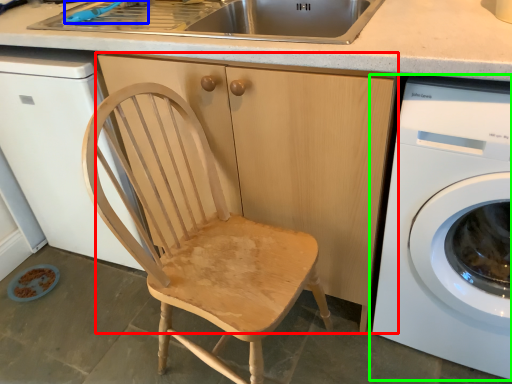
Question: Which object is the closest to the cabinetry (highlighted by a red box)? Choose among these: faucet (highlighted by a blue box) or washing machine (highlighted by a green box).

Choices:
 (A) faucet
 (B) washing machine

Answer: (B)